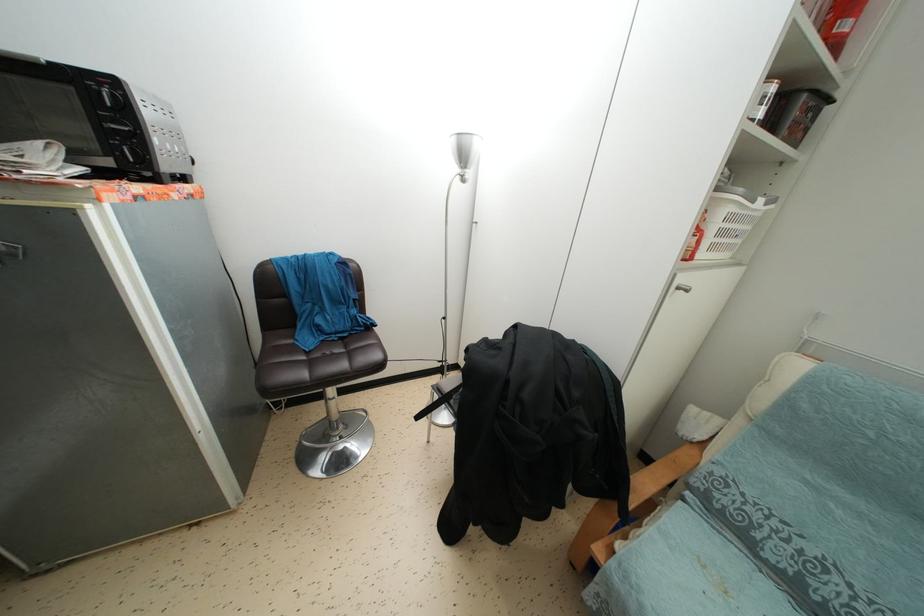
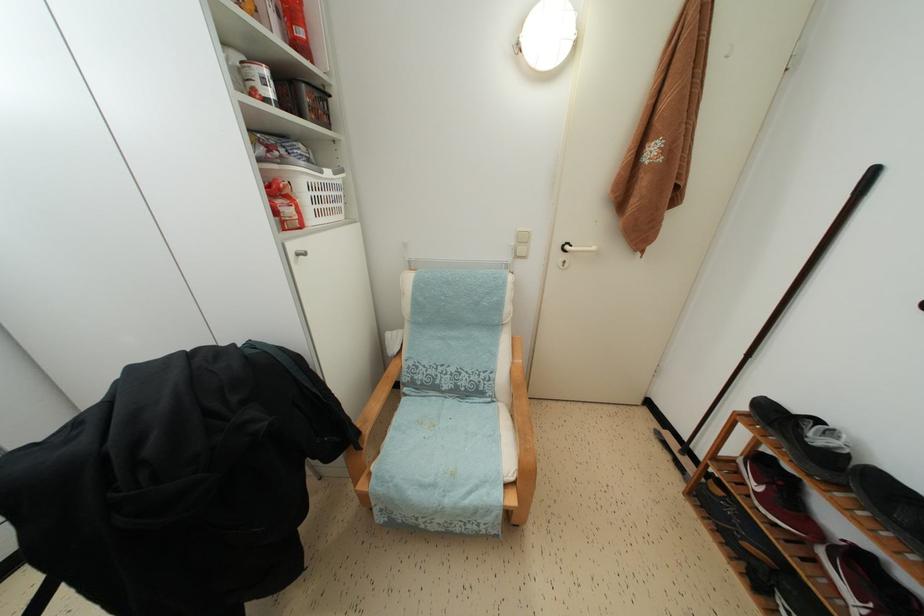
Find the pixel in the second image that matches the point at 623,552 in the first image.

(377, 472)